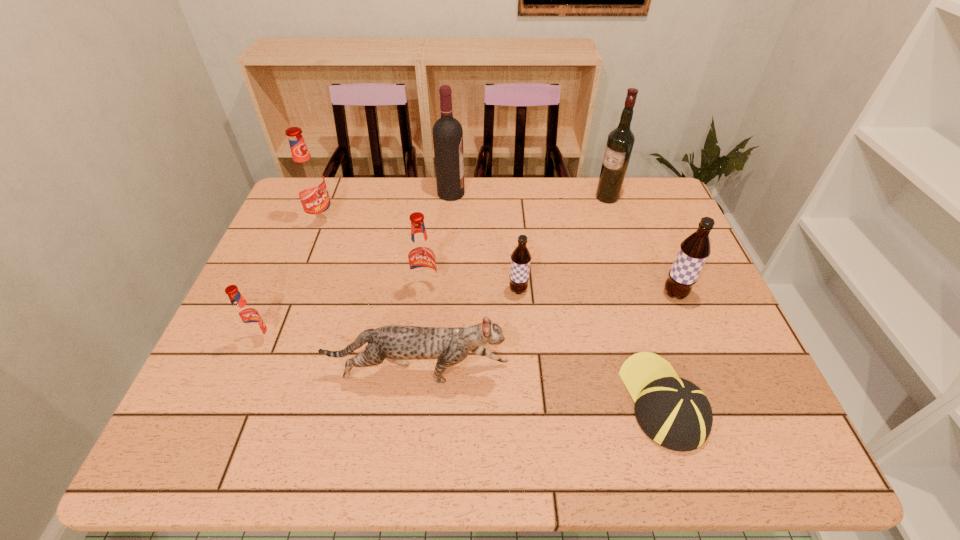
Where is `the left wine bottle`? the left wine bottle is located at coordinates (447, 131).

Locate an element on the screen. Image resolution: width=960 pixels, height=540 pixels. the right wine bottle is located at coordinates (620, 141).

Where is `the farthest root beer`? the farthest root beer is located at coordinates (308, 179).

At what (x,y) coordinates should I click in order to perform the action: click on the third tallest object. Please return your answer as a coordinate pair (x, y). The image size is (960, 540). Looking at the image, I should click on (308, 179).

Locate an element on the screen. The height and width of the screenshot is (540, 960). the rightmost red root beer is located at coordinates (422, 262).

Locate an element on the screen. The width and height of the screenshot is (960, 540). the second biggest red root beer is located at coordinates (422, 262).

Find the location of a particular element. Image resolution: width=960 pixels, height=540 pixels. the rightmost root beer is located at coordinates (694, 250).

Locate an element on the screen. the right brown root beer is located at coordinates (694, 250).

Identify the location of the nearest root beer. (246, 316).

The height and width of the screenshot is (540, 960). Identify the location of the seventh farthest object. (246, 316).